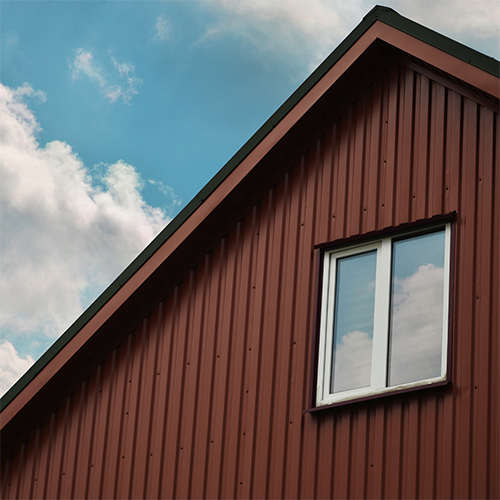
Where is `window`? The width and height of the screenshot is (500, 500). window is located at coordinates (385, 343).